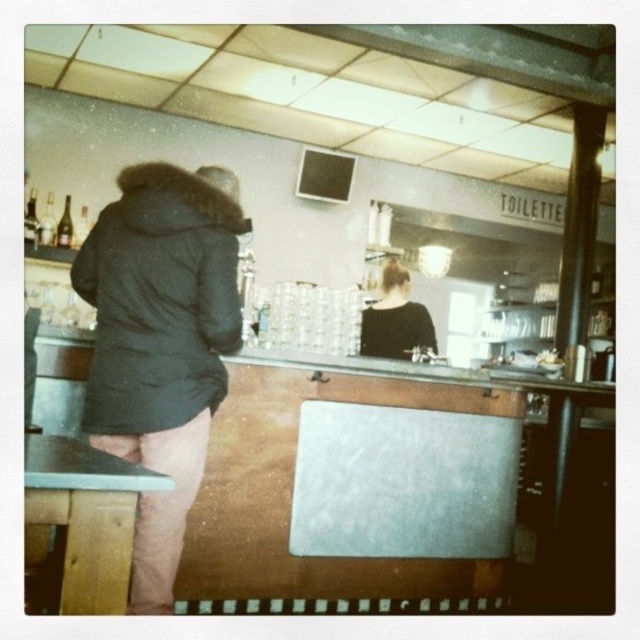
You are a customer at this establishment and you want to order a drink. The barista is wearing the black matte shirt at center. Where is the barista located relative to the metallic silver exhaust hood at upper center?

The black matte shirt at center is behind the metallic silver exhaust hood at upper center, so the barista is behind the metallic silver exhaust hood at upper center.

You are a customer at this establishment and want to sit down. There is a wooden bar stool at lower left and a black matte shirt at center. Which object is closer to you where you can reach it easily?

The wooden bar stool at lower left is closer to the viewer than the black matte shirt at center, so you can reach it easily.

Consider the image. You are a customer at this establishment and want to know if the metallic silver exhaust hood at upper center is taller than the black matte shirt at center. Can you confirm this based on the scene?

The metallic silver exhaust hood at upper center is shorter than the black matte shirt at center, so it is not taller.